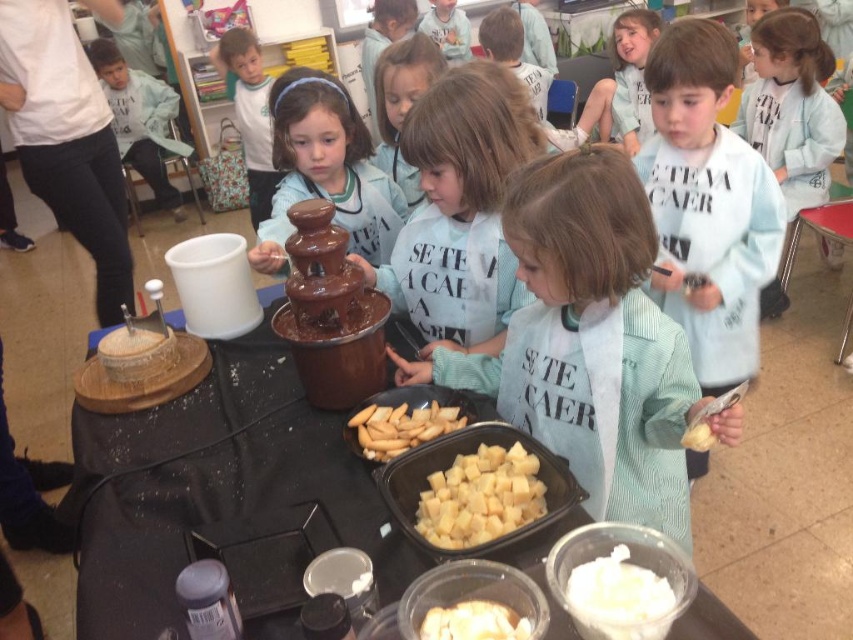
You are standing at point [509,160] and want to reach the chocolate fountain. The chocolate fountain is 4.51 feet away from you. Is the chocolate fountain closer than 5 feet?

Yes, the chocolate fountain is 4.51 feet away from you, which is closer than 5 feet.